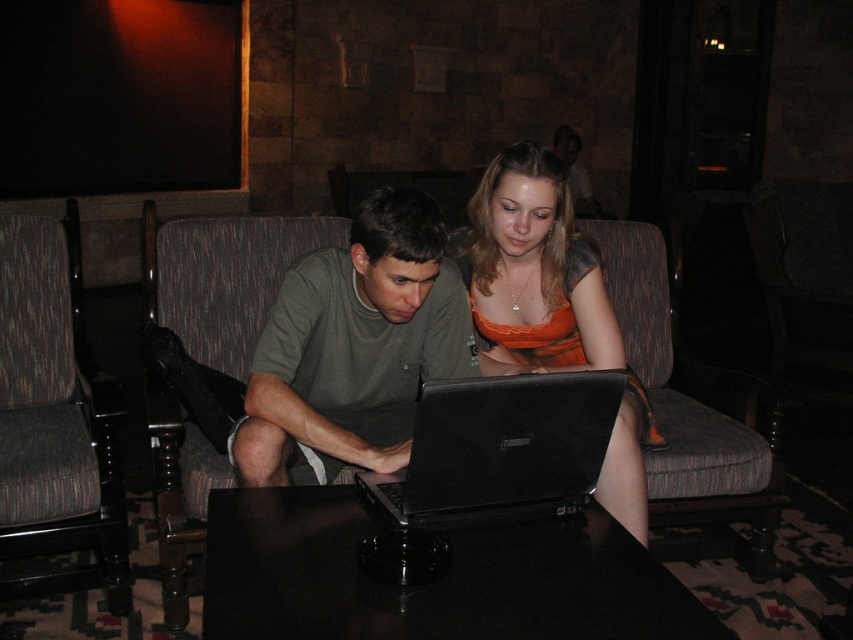
You are a delivery person who needs to place a small package on the table in the image. The package is 10 cm in length. Can you place it on the black glossy table at center without covering the matte black laptop at center?

The matte black laptop at center is larger in size than the black glossy table at center. Since the laptop is larger than the table, placing the package might not be possible as the laptop already occupies most of the table space. Therefore, the package cannot be placed on the black glossy table at center without covering the matte black laptop at center.

You are a photographer setting up a shoot in this scene. You need to place a small lamp between the green matte shirt at center and the dark brown fabric armchair at left. Which object should the lamp be closer to if you want it to be equidistant from both?

The lamp should be placed closer to the green matte shirt at center because it is smaller than the dark brown fabric armchair at left, so to maintain equal distance, the lamp needs to be positioned nearer to the smaller object.

You are a delivery person who needs to place a small package on the table. The package is 10 cm in height. Can you safely place it on the black glossy table at center without covering the matte black laptop at center?

The matte black laptop at center is above the black glossy table at center, so placing the package on the table won t interfere with the laptop since the laptop is elevated.